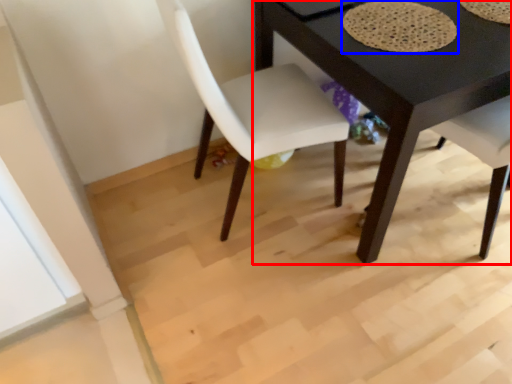
Question: Among these objects, which one is nearest to the camera, table (highlighted by a red box) or mat (highlighted by a blue box)?

Choices:
 (A) table
 (B) mat

Answer: (A)